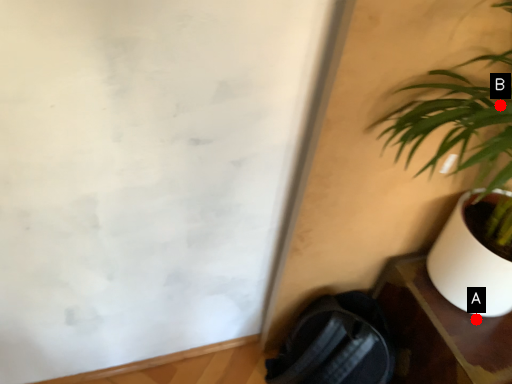
Question: Two points are circled on the image, labeled by A and B beside each circle. Which point appears farthest from the camera in this image?

Choices:
 (A) A is further
 (B) B is further

Answer: (A)